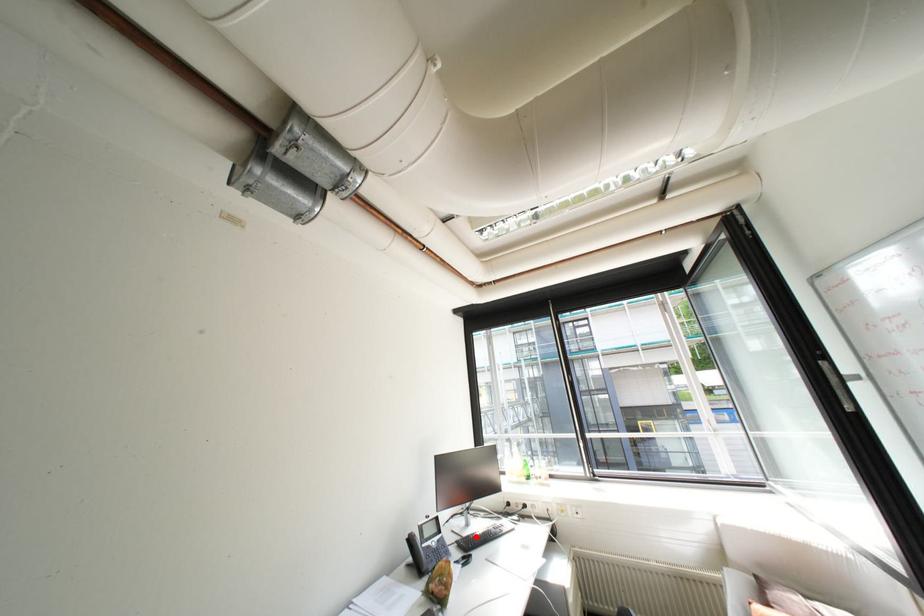
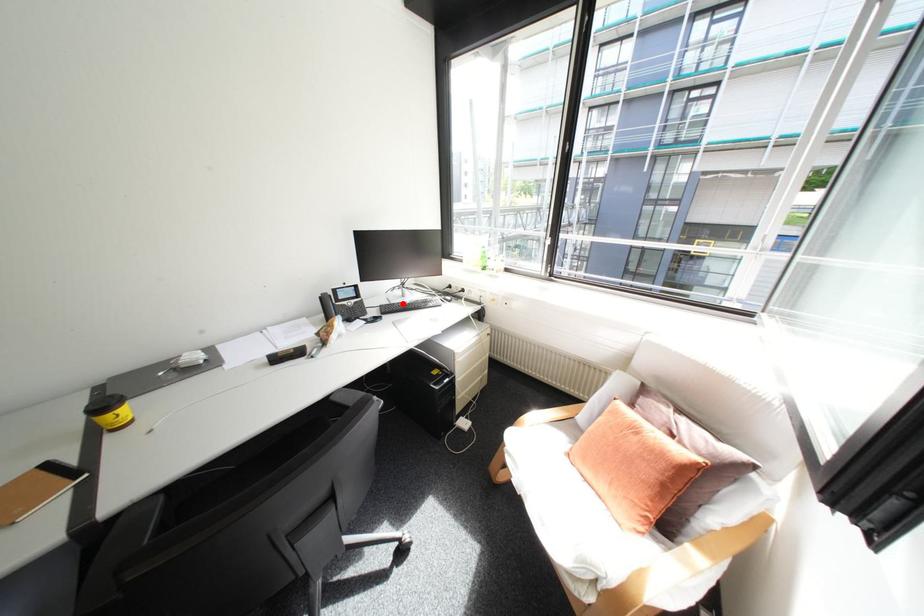
I am providing you with two images of the same scene from different viewpoints. A red point is marked on the first image and another point is marked on the second image. Do the highlighted points in image1 and image2 indicate the same real-world spot?

Yes